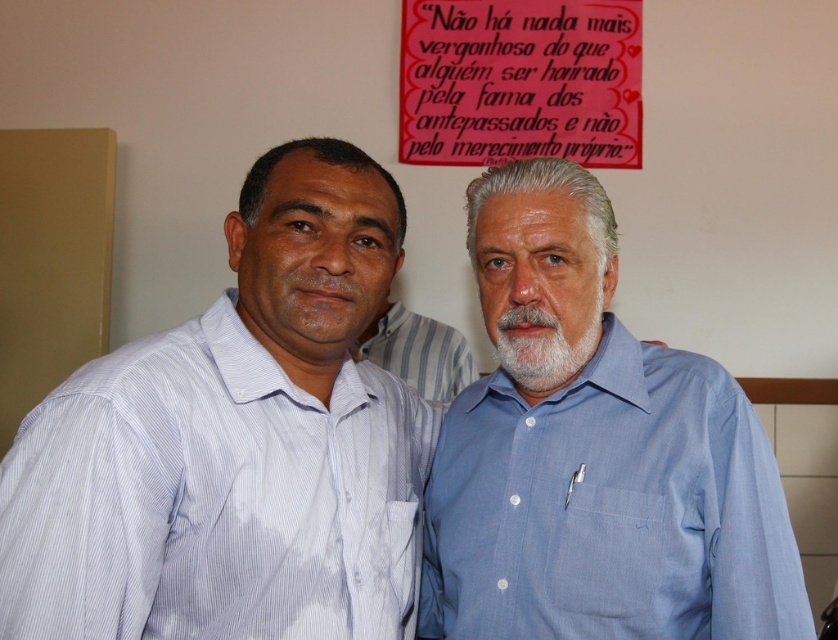
Question: Is striped cotton shirt at center smaller than white soft beard at center?

Choices:
 (A) yes
 (B) no

Answer: (B)

Question: Which of the following is the farthest from the observer?

Choices:
 (A) matte red poster at upper center
 (B) white striped shirt at left

Answer: (A)

Question: Considering the real-world distances, which object is farthest from the white soft beard at center?

Choices:
 (A) striped cotton shirt at center
 (B) matte red poster at upper center
 (C) blue cotton shirt at right
 (D) white striped shirt at left

Answer: (B)

Question: Can you confirm if blue cotton shirt at right is wider than matte red poster at upper center?

Choices:
 (A) yes
 (B) no

Answer: (B)

Question: Estimate the real-world distances between objects in this image. Which object is closer to the white soft beard at center?

Choices:
 (A) white striped shirt at left
 (B) striped cotton shirt at center
 (C) blue cotton shirt at right

Answer: (C)

Question: Where is blue cotton shirt at right located in relation to striped cotton shirt at center in the image?

Choices:
 (A) above
 (B) below

Answer: (B)